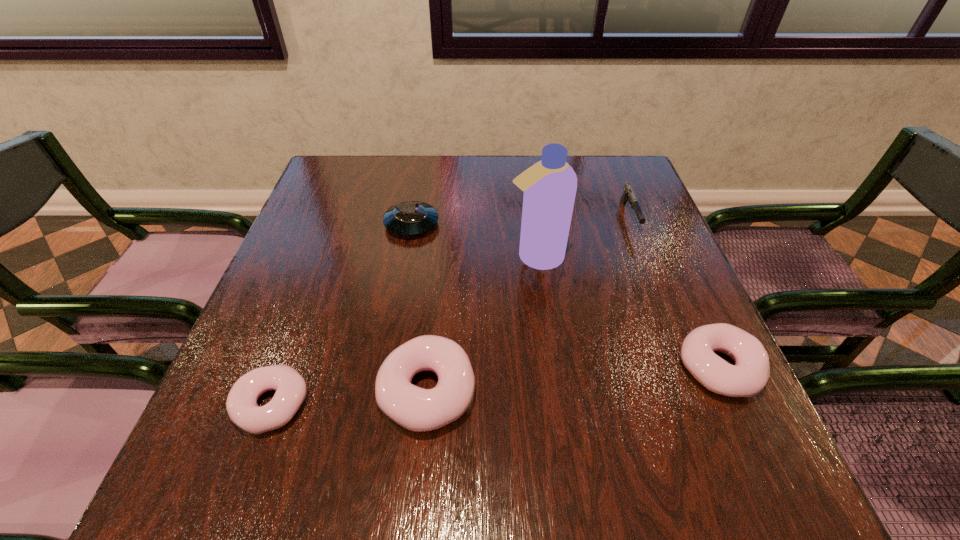
This screenshot has height=540, width=960. I want to click on free point located on the left of the second tallest doughnut, so click(x=548, y=368).

Find the location of a particular element. Image resolution: width=960 pixels, height=540 pixels. free space located 0.290m at the muzzle end of the gun is located at coordinates (674, 334).

Identify the location of free space located 0.220m on the right of the saucer. Image resolution: width=960 pixels, height=540 pixels. (526, 224).

At what (x,y) coordinates should I click in order to perform the action: click on vacant space located 0.340m on the back of the fourth object from left to right. Please return your answer as a coordinate pair (x, y). Looking at the image, I should click on (524, 167).

What are the coordinates of `object situated at the far edge` in the screenshot? It's located at (628, 195).

The image size is (960, 540). I want to click on object at the left edge, so click(291, 389).

The height and width of the screenshot is (540, 960). What are the coordinates of `doughnut at the right edge` in the screenshot? It's located at click(x=748, y=376).

This screenshot has width=960, height=540. Identify the location of gun present at the right edge. (628, 195).

This screenshot has height=540, width=960. In order to click on object positioned at the near left corner in this screenshot , I will do `click(291, 389)`.

What are the coordinates of `object that is at the far right corner` in the screenshot? It's located at (628, 195).